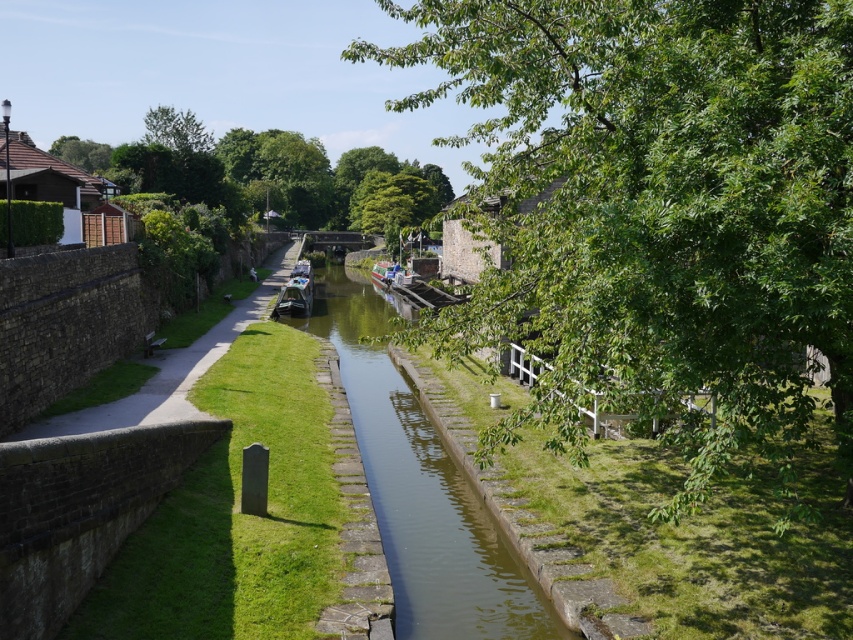
Who is shorter, green leafy tree at center or green stone canal at center?

green stone canal at center

This screenshot has width=853, height=640. Describe the element at coordinates (656, 212) in the screenshot. I see `green leafy tree at center` at that location.

This screenshot has width=853, height=640. I want to click on green leafy tree at center, so click(656, 212).

Is green stone canal at center smaller than smooth black boat at center?

Actually, green stone canal at center might be larger than smooth black boat at center.

Does green stone canal at center have a larger size compared to smooth black boat at center?

Yes.

Does point (407, 387) come behind point (302, 260)?

No, it is in front of (302, 260).

The image size is (853, 640). I want to click on green stone canal at center, so click(422, 490).

Between green leafy tree at center and smooth concrete path at left, which one is positioned lower?

smooth concrete path at left is lower down.

Does green leafy tree at center have a larger size compared to smooth concrete path at left?

Yes.

Describe the element at coordinates (656, 212) in the screenshot. The height and width of the screenshot is (640, 853). I see `green leafy tree at center` at that location.

Locate an element on the screen. This screenshot has height=640, width=853. green leafy tree at center is located at coordinates (656, 212).